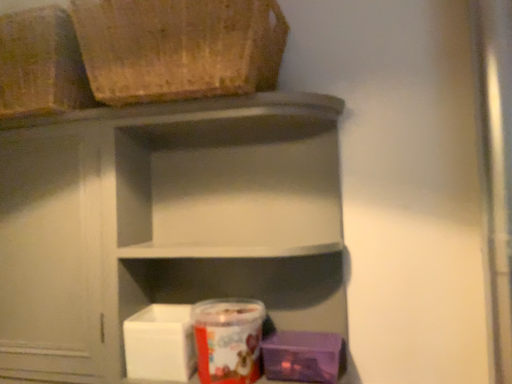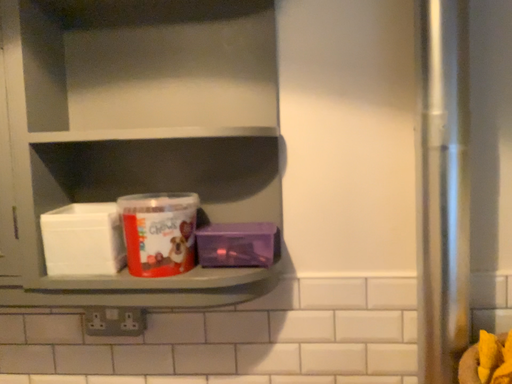
Question: How did the camera likely rotate when shooting the video?

Choices:
 (A) rotated upward
 (B) rotated downward

Answer: (B)